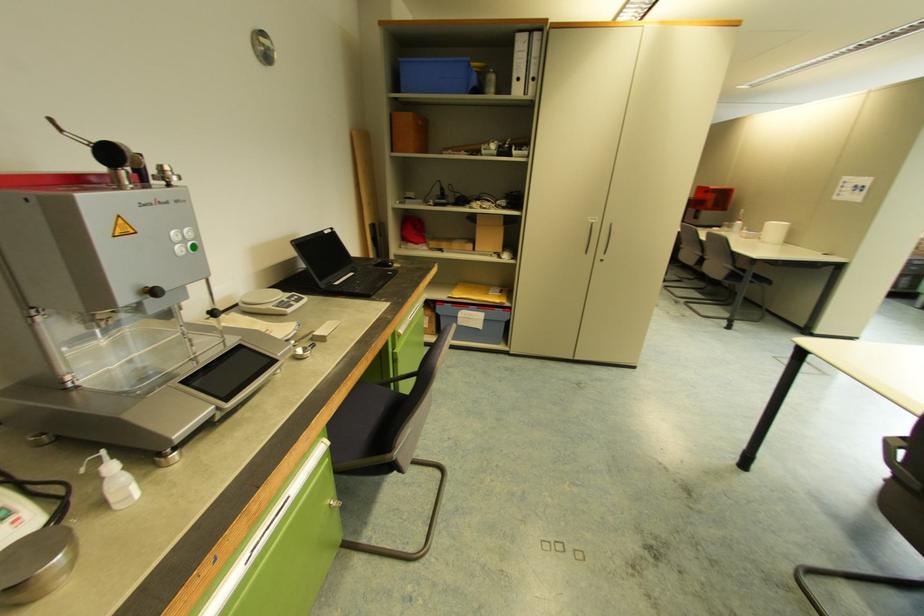
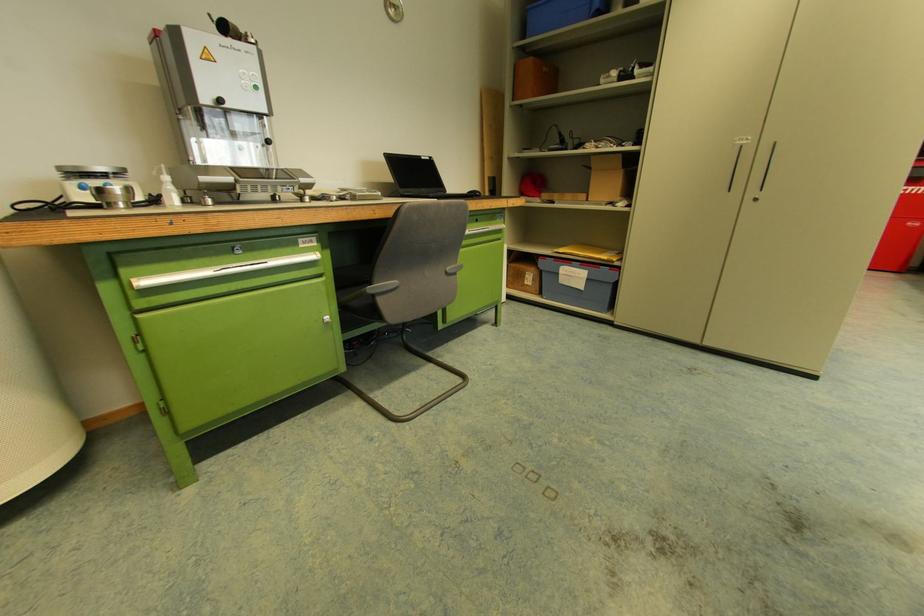
Where in the second image is the point corresponding to (x=489, y=320) from the first image?

(591, 280)